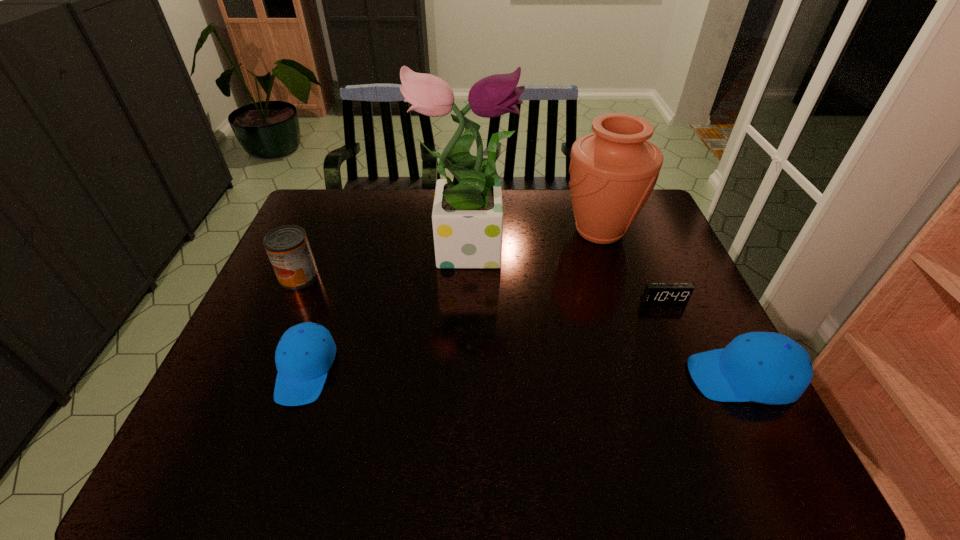
This screenshot has width=960, height=540. I want to click on vacant space at the far left corner of the desktop, so click(318, 220).

In the image, there is a desktop. Identify the location of free space at the far right corner. This screenshot has width=960, height=540. 645,224.

Where is `blank region between the fourth farthest object and the can`? This screenshot has height=540, width=960. blank region between the fourth farthest object and the can is located at coordinates (481, 288).

Find the location of `free spot between the second tallest object and the tallest object`. free spot between the second tallest object and the tallest object is located at coordinates (533, 238).

This screenshot has width=960, height=540. In order to click on empty location between the taller cap and the third object from left to right in this screenshot , I will do `click(604, 310)`.

Find the location of a particular element. The width and height of the screenshot is (960, 540). vacant area that lies between the fourth object from right to left and the taller cap is located at coordinates (604, 310).

Locate an element on the screen. This screenshot has width=960, height=540. vacant area between the shorter cap and the fifth shortest object is located at coordinates (452, 301).

Find the location of `free space between the third shortest object and the left cap`. free space between the third shortest object and the left cap is located at coordinates (524, 373).

Locate an element on the screen. vacant space that is in between the tallest object and the fifth tallest object is located at coordinates (386, 307).

Locate an element on the screen. This screenshot has height=540, width=960. free spot between the taller cap and the fifth tallest object is located at coordinates (524, 373).